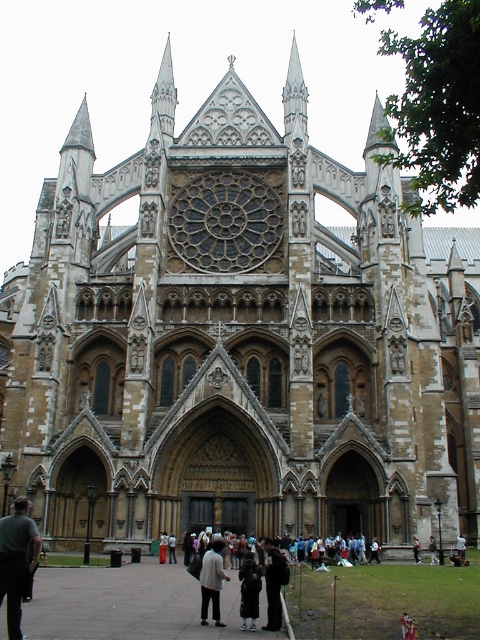
Question: Can you confirm if white cotton shirt at center is bigger than light brown leather jacket at center?

Choices:
 (A) no
 (B) yes

Answer: (B)

Question: Does light beige fabric coat at center have a larger size compared to dark brown leather coat at center?

Choices:
 (A) no
 (B) yes

Answer: (B)

Question: Which of the following is the closest to the observer?

Choices:
 (A) (432, 548)
 (B) (15, 612)

Answer: (B)

Question: Does dark gray fabric jacket at lower left have a larger size compared to light brown leather jacket at center?

Choices:
 (A) no
 (B) yes

Answer: (B)

Question: Which of the following is the farthest from the observer?

Choices:
 (A) white cotton shirt at center
 (B) dark brown leather coat at center
 (C) light brown leather jacket at center

Answer: (A)

Question: Which point is closer to the camera?

Choices:
 (A) dark gray fabric jacket at lower left
 (B) light brown leather jacket at center

Answer: (A)